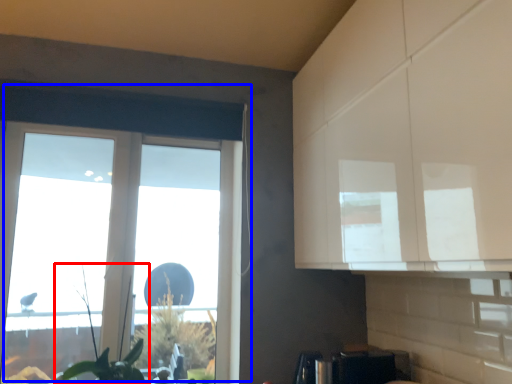
Question: Which of the following is the farthest to the observer, plant (highlighted by a red box) or window (highlighted by a blue box)?

Choices:
 (A) plant
 (B) window

Answer: (B)